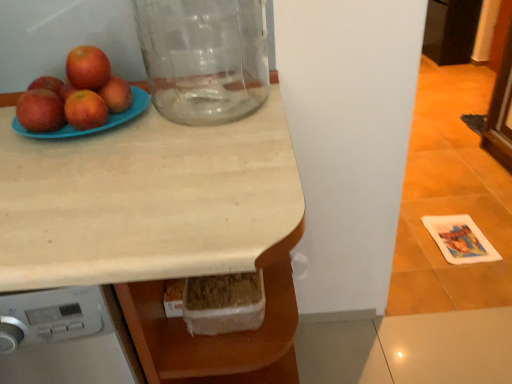
Question: Could you tell me if glossy red apple at left, marked as the fourth apple in a right-to-left arrangement, is turned towards transparent glass jar at upper left?

Choices:
 (A) yes
 (B) no

Answer: (B)

Question: Does glossy red apple at left, which is the first apple from left to right, have a greater height compared to transparent glass jar at upper left?

Choices:
 (A) no
 (B) yes

Answer: (A)

Question: Can you confirm if glossy red apple at left, which is the first apple from left to right, is positioned to the right of transparent glass jar at upper left?

Choices:
 (A) yes
 (B) no

Answer: (B)

Question: From a real-world perspective, is glossy red apple at left, which is the first apple from left to right, located higher than transparent glass jar at upper left?

Choices:
 (A) yes
 (B) no

Answer: (B)

Question: Is glossy red apple at left, marked as the fourth apple in a right-to-left arrangement, outside transparent glass jar at upper left?

Choices:
 (A) no
 (B) yes

Answer: (B)

Question: From a real-world perspective, is transparent glass jar at upper left physically located above or below matte blue plate at upper left?

Choices:
 (A) below
 (B) above

Answer: (B)

Question: Would you say transparent glass jar at upper left is inside or outside matte blue plate at upper left?

Choices:
 (A) outside
 (B) inside

Answer: (A)

Question: Is transparent glass jar at upper left bigger or smaller than matte blue plate at upper left?

Choices:
 (A) big
 (B) small

Answer: (A)

Question: Visually, is transparent glass jar at upper left positioned to the left or to the right of matte blue plate at upper left?

Choices:
 (A) right
 (B) left

Answer: (A)

Question: From a real-world perspective, is matte red apple at upper left, placed as the first apple when sorted from right to left, positioned above or below transparent glass jar at upper left?

Choices:
 (A) below
 (B) above

Answer: (A)

Question: From the image's perspective, relative to transparent glass jar at upper left, is matte red apple at upper left, which is the fourth apple from left to right, above or below?

Choices:
 (A) above
 (B) below

Answer: (B)

Question: Considering the positions of matte red apple at upper left, placed as the first apple when sorted from right to left, and transparent glass jar at upper left in the image, is matte red apple at upper left, placed as the first apple when sorted from right to left, bigger or smaller than transparent glass jar at upper left?

Choices:
 (A) small
 (B) big

Answer: (A)

Question: Relative to transparent glass jar at upper left, is matte red apple at upper left, placed as the first apple when sorted from right to left, in front or behind?

Choices:
 (A) front
 (B) behind

Answer: (B)

Question: Is point (35, 180) closer or farther from the camera than point (79, 87)?

Choices:
 (A) farther
 (B) closer

Answer: (B)

Question: From the image's perspective, is light wood countertop at center located above or below shiny red apple at upper left, the second apple viewed from the left?

Choices:
 (A) below
 (B) above

Answer: (A)